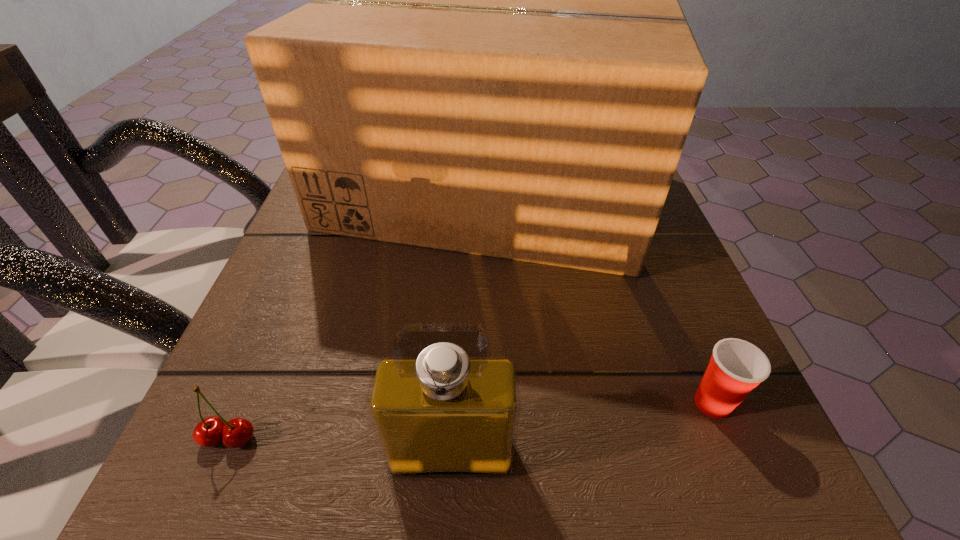
Where is `vacant space at the near left corner`? The width and height of the screenshot is (960, 540). vacant space at the near left corner is located at coordinates (245, 482).

I want to click on vacant region between the Dixie cup and the second tallest object, so click(x=582, y=428).

Where is `unoccupied position between the cherry and the third shortest object`? The width and height of the screenshot is (960, 540). unoccupied position between the cherry and the third shortest object is located at coordinates (340, 446).

Identify the location of unoccupied position between the cherry and the tallest object. (357, 316).

Identify the location of free space between the second tallest object and the cherry. (340, 446).

Identify the location of free space that is in between the farthest object and the cherry. (357, 316).

At what (x,y) coordinates should I click in order to perform the action: click on empty space between the box and the cherry. Please return your answer as a coordinate pair (x, y). Looking at the image, I should click on (357, 316).

This screenshot has height=540, width=960. Find the location of `vacant area that lies between the Dixie cup and the box`. vacant area that lies between the Dixie cup and the box is located at coordinates (599, 299).

Choose which object is the second nearest neighbor to the box. Please provide its 2D coordinates. Your answer should be formatted as a tuple, i.e. [(x, y)], where the tuple contains the x and y coordinates of a point satisfying the conditions above.

[(209, 432)]

This screenshot has height=540, width=960. Find the location of `object that is the third closest to the cherry`. object that is the third closest to the cherry is located at coordinates (736, 367).